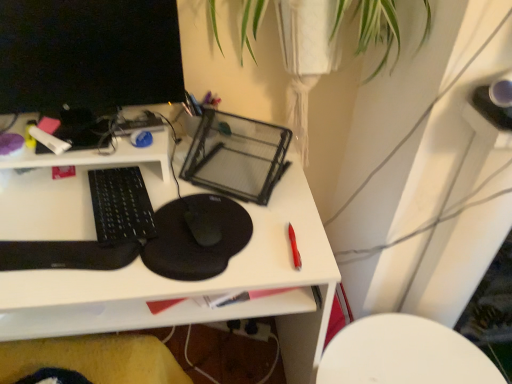
At what (x,y) coordinates should I click in order to perform the action: click on free point above black matte mousepad at center (from a real-world perspective). Please return your answer as a coordinate pair (x, y). Image resolution: width=512 pixels, height=384 pixels. Looking at the image, I should click on (158, 209).